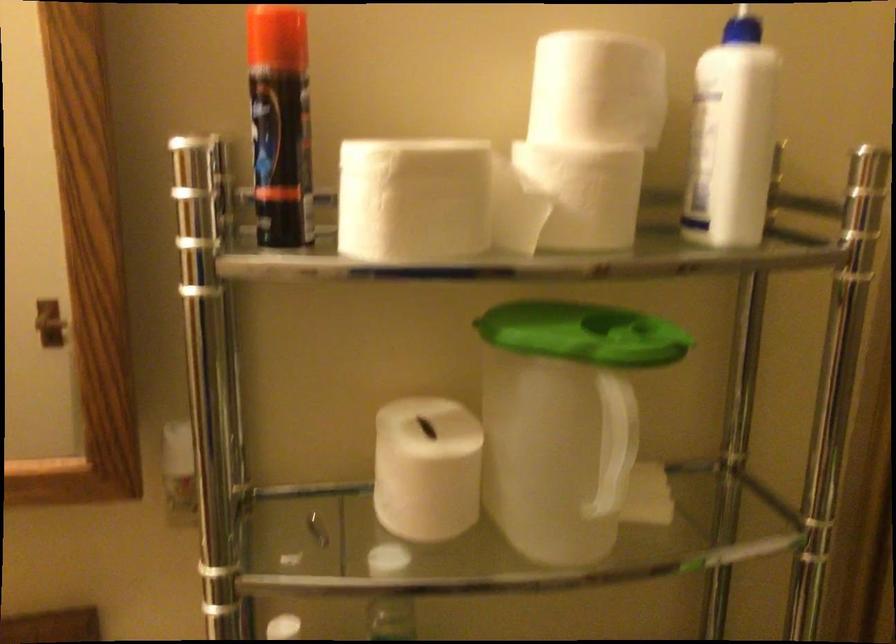
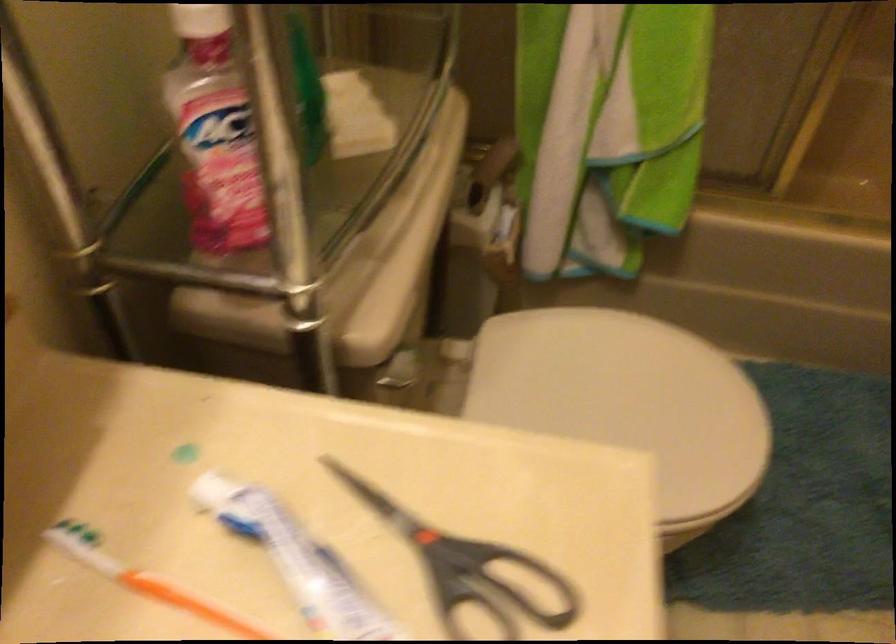
In the scene shown: First-person continuous shooting, in which direction is the camera rotating?

The rotation direction of the camera is right-down.